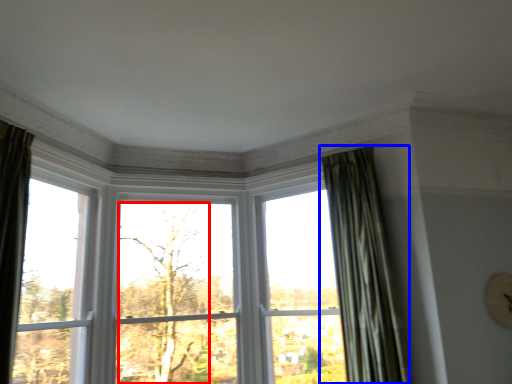
Question: Which of the following is the closest to the observer, tree (highlighted by a red box) or curtain (highlighted by a blue box)?

Choices:
 (A) tree
 (B) curtain

Answer: (B)